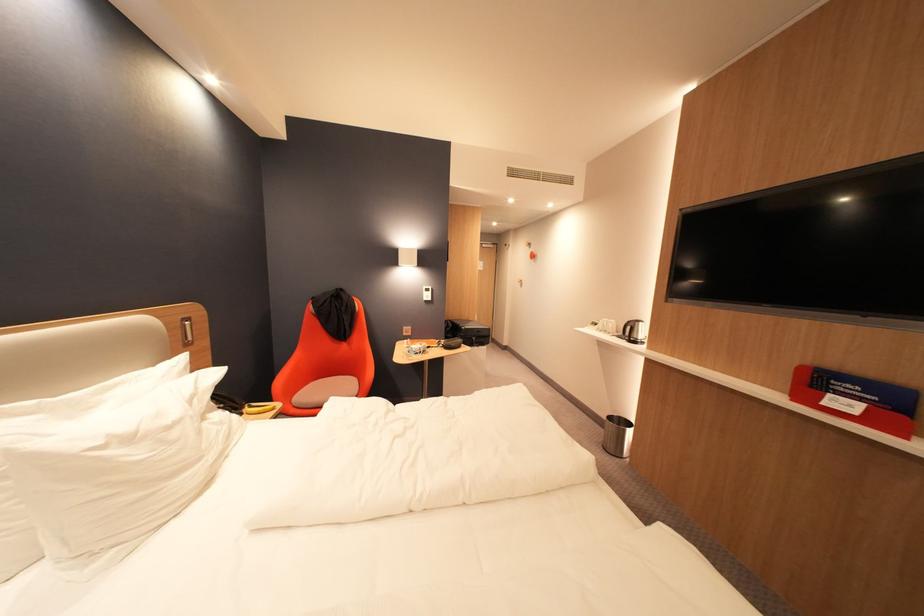
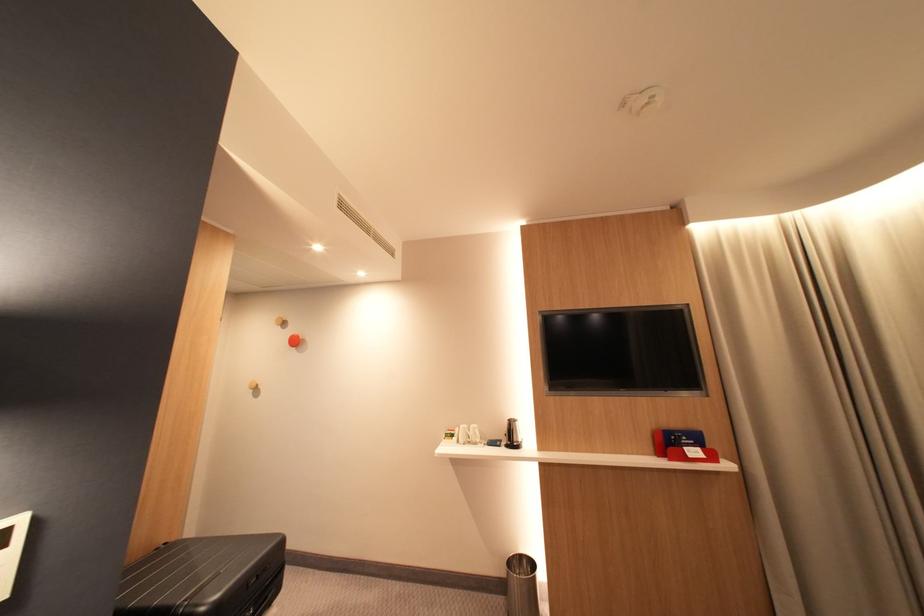
Find the pixel in the second image that matches point 841,395 in the first image.

(696, 450)